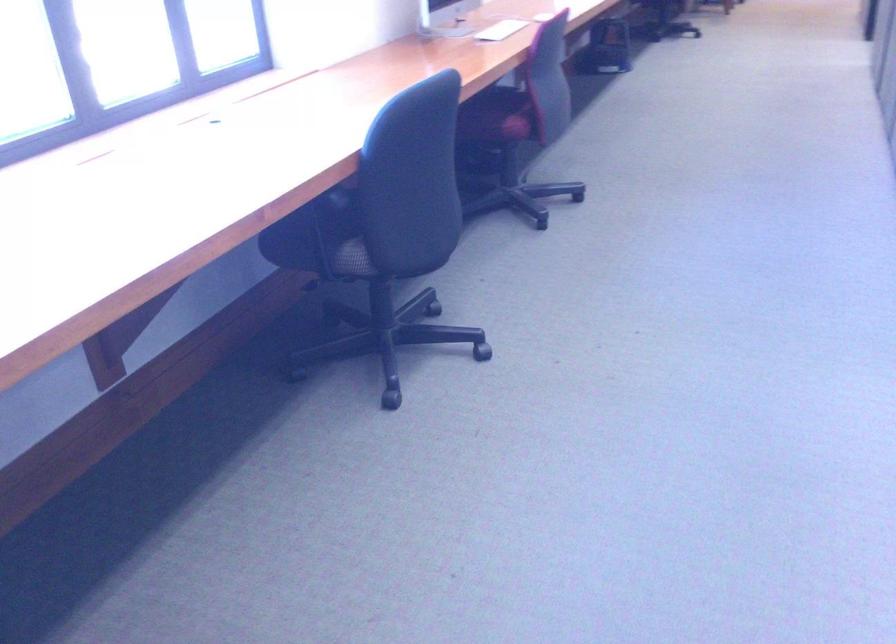
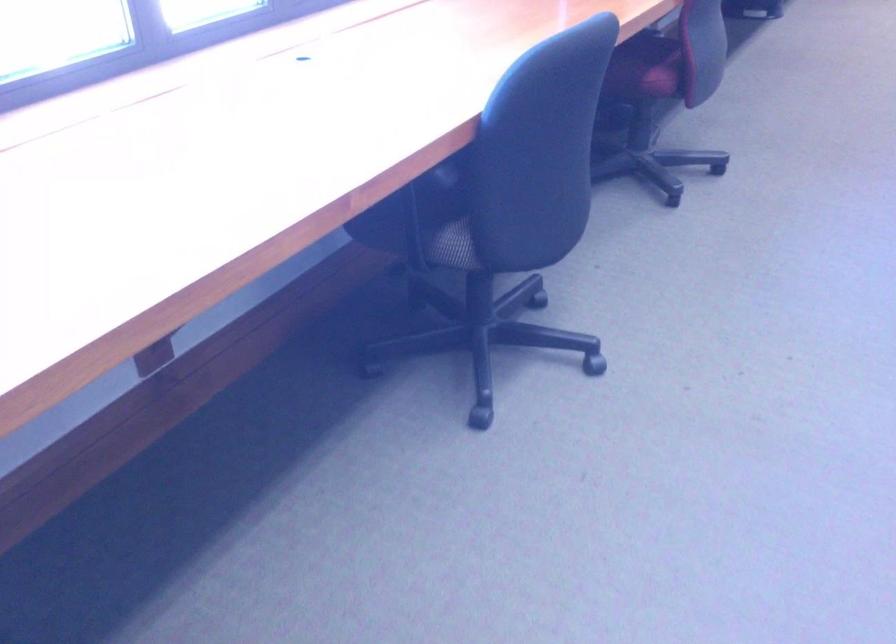
Question: The camera is either moving clockwise (left) or counter-clockwise (right) around the object. The first image is from the beginning of the video and the second image is from the end. Is the camera moving left or right when shooting the video?

Choices:
 (A) Left
 (B) Right

Answer: (B)